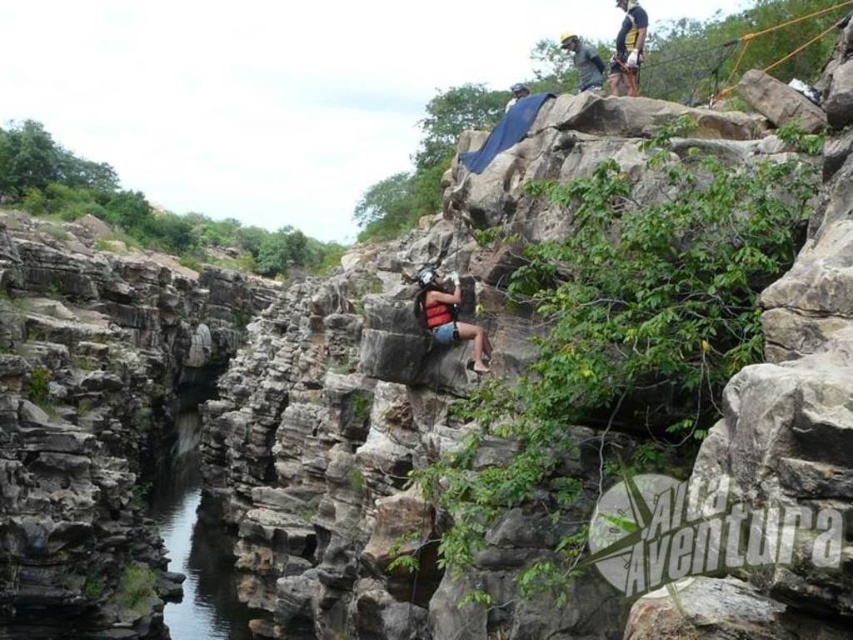
You are an adventure guide assessing the safety of the canyon for a group. You notice the orange nylon rope bridge at upper right and the matte red life vest at center. Which object is positioned higher in the scene?

The orange nylon rope bridge at upper right is much taller than the matte red life vest at center, so the orange nylon rope bridge at upper right is positioned higher in the scene.

You are an adventurer planning to rappel down the cliff in the canyon scene. You notice a point marked at coordinates [195,531]. What is located at this point?

The point at coordinates [195,531] corresponds to clear water at center.